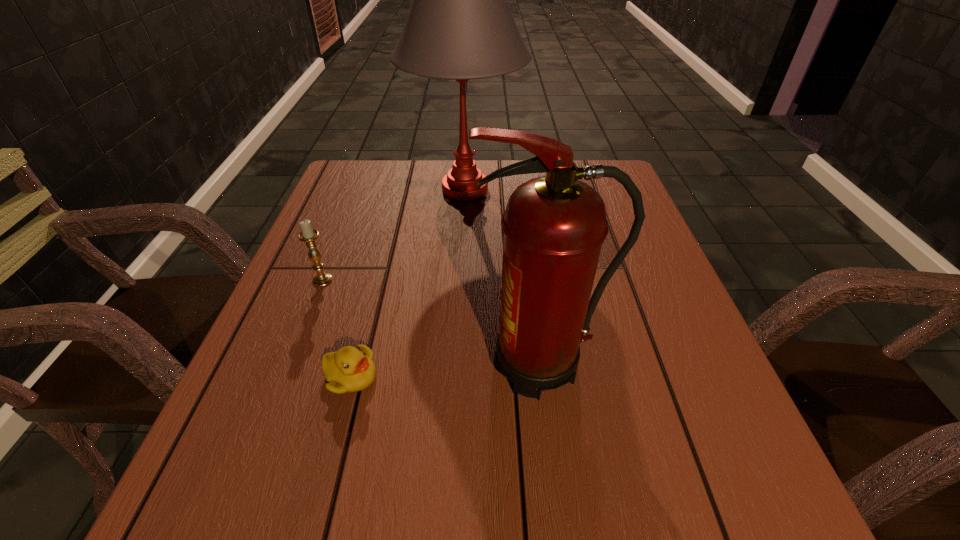
What are the coordinates of `free location located on the front of the second shortest object` in the screenshot? It's located at (250, 467).

You are a GUI agent. You are given a task and a screenshot of the screen. Output one action in this format:
    pyautogui.click(x=<x>, y=<y>)
    Task: Click on the vacant space situated on the front-facing side of the shortest object
    This screenshot has height=540, width=960.
    Given the screenshot: What is the action you would take?
    pyautogui.click(x=605, y=376)

Where is `object at the far edge`? The image size is (960, 540). object at the far edge is located at coordinates (459, 27).

I want to click on candle holder that is at the left edge, so click(308, 235).

In order to click on duckling located at the left edge in this screenshot , I will do `click(350, 369)`.

The width and height of the screenshot is (960, 540). Identify the location of free spot at the far edge of the desktop. (402, 201).

In order to click on vacant space at the left edge of the desktop in this screenshot , I will do `click(329, 346)`.

Locate an element on the screen. The height and width of the screenshot is (540, 960). free space at the right edge of the desktop is located at coordinates (672, 336).

You are a GUI agent. You are given a task and a screenshot of the screen. Output one action in this format:
    pyautogui.click(x=<x>, y=<y>)
    Task: Click on the vacant space at the far left corner of the desktop
    The width and height of the screenshot is (960, 540).
    Given the screenshot: What is the action you would take?
    pyautogui.click(x=362, y=174)

Identify the location of vacant region at the near right corner of the desktop. (754, 525).